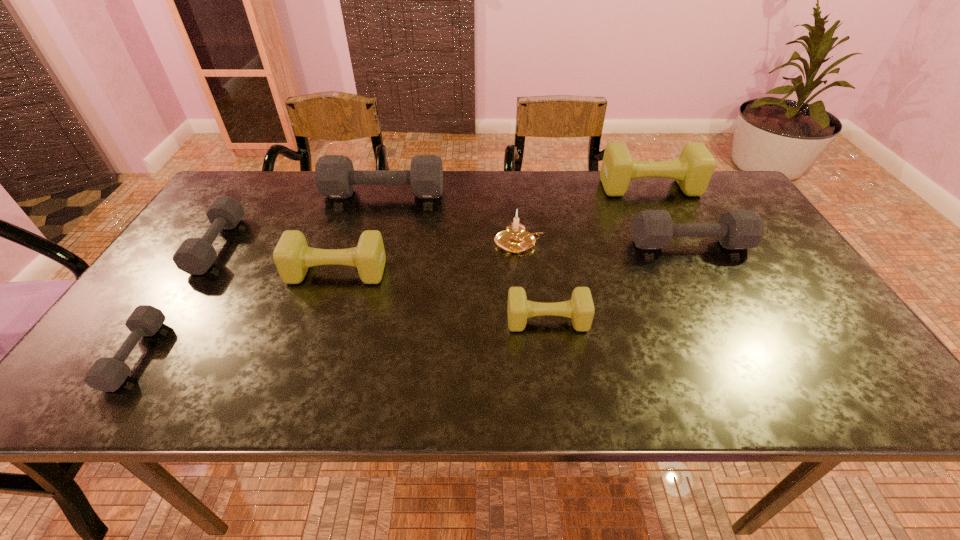
Where is `free space that is in between the candle holder and the second gray dumbbell from right to left`? The height and width of the screenshot is (540, 960). free space that is in between the candle holder and the second gray dumbbell from right to left is located at coordinates (451, 219).

The width and height of the screenshot is (960, 540). Find the location of `unoccupied position between the second biggest gray dumbbell and the farthest gray dumbbell`. unoccupied position between the second biggest gray dumbbell and the farthest gray dumbbell is located at coordinates (537, 219).

Locate an element on the screen. The height and width of the screenshot is (540, 960). free area in between the smallest olive dumbbell and the second smallest gray dumbbell is located at coordinates (382, 283).

This screenshot has height=540, width=960. I want to click on vacant area that lies between the second smallest olive dumbbell and the rightmost gray dumbbell, so click(x=514, y=259).

This screenshot has height=540, width=960. I want to click on empty space that is in between the candle holder and the farthest olive dumbbell, so pos(584,215).

You are a GUI agent. You are given a task and a screenshot of the screen. Output one action in this format:
    pyautogui.click(x=<x>, y=<y>)
    Task: Click on the vacant space that is in between the third biggest gray dumbbell and the rightmost gray dumbbell
    Image resolution: width=960 pixels, height=540 pixels.
    Given the screenshot: What is the action you would take?
    click(454, 245)

Locate an element on the screen. free point between the nearest gray dumbbell and the candle holder is located at coordinates (326, 299).

The width and height of the screenshot is (960, 540). Find the location of `object that stands as the sixth closest to the leftmost olive dumbbell`. object that stands as the sixth closest to the leftmost olive dumbbell is located at coordinates (652, 229).

Where is `object that is the fifth nearest to the farthest olive dumbbell`? object that is the fifth nearest to the farthest olive dumbbell is located at coordinates (292, 256).

Choose which dumbbell is the fourth nearest neighbor to the farthest olive dumbbell. Please provide its 2D coordinates. Your answer should be formatted as a tuple, i.e. [(x, y)], where the tuple contains the x and y coordinates of a point satisfying the conditions above.

[(292, 256)]